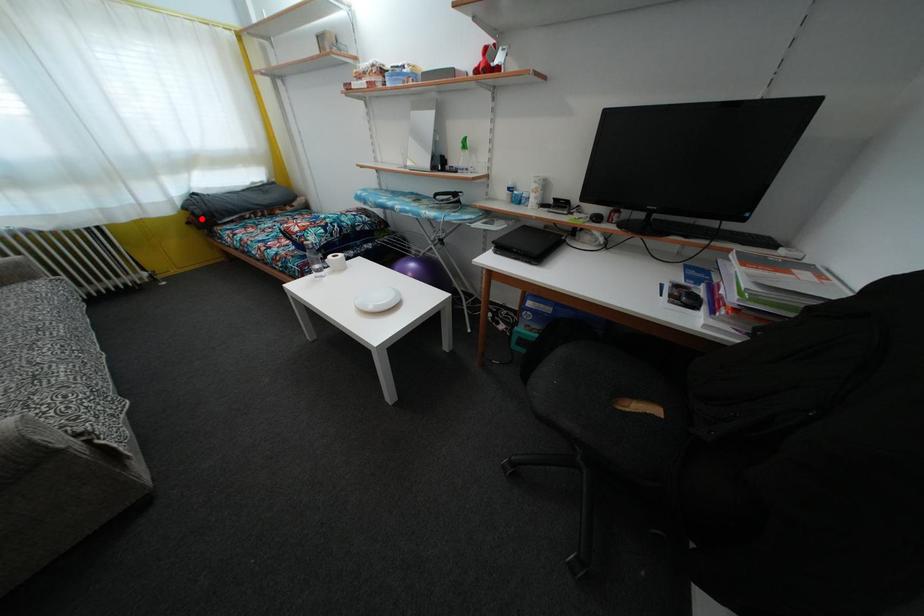
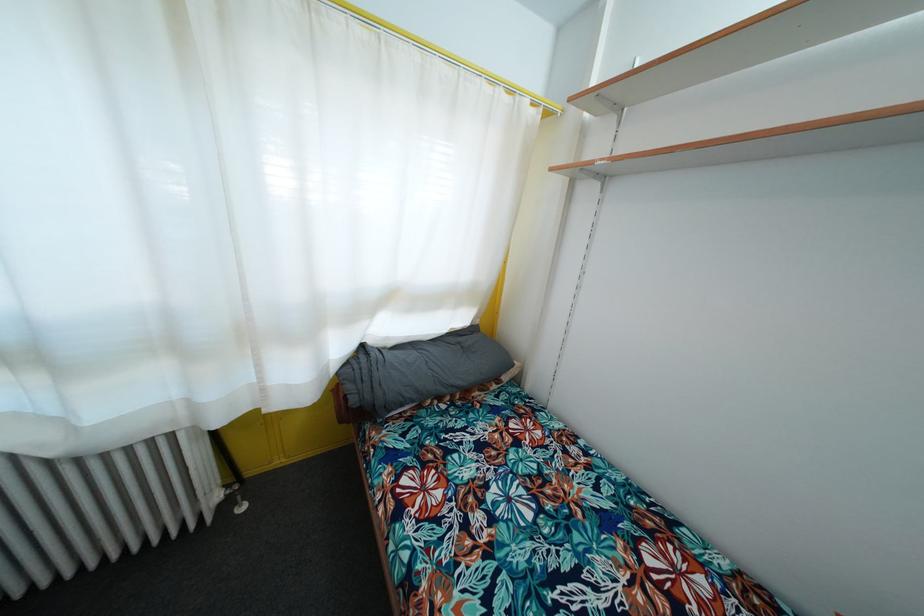
The point at the highlighted location is marked in the first image. Where is the corresponding point in the second image?

(358, 407)